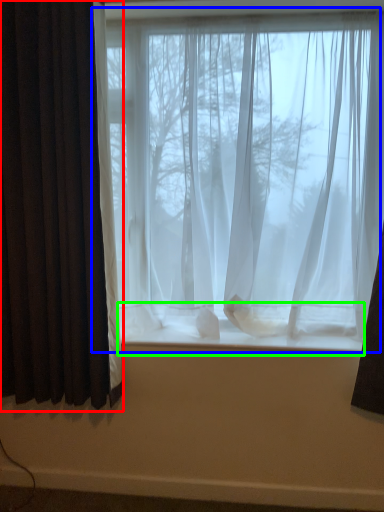
Question: Which object is positioned closest to curtain (highlighted by a red box)? Select from window (highlighted by a blue box) and window sill (highlighted by a green box).

Choices:
 (A) window
 (B) window sill

Answer: (A)